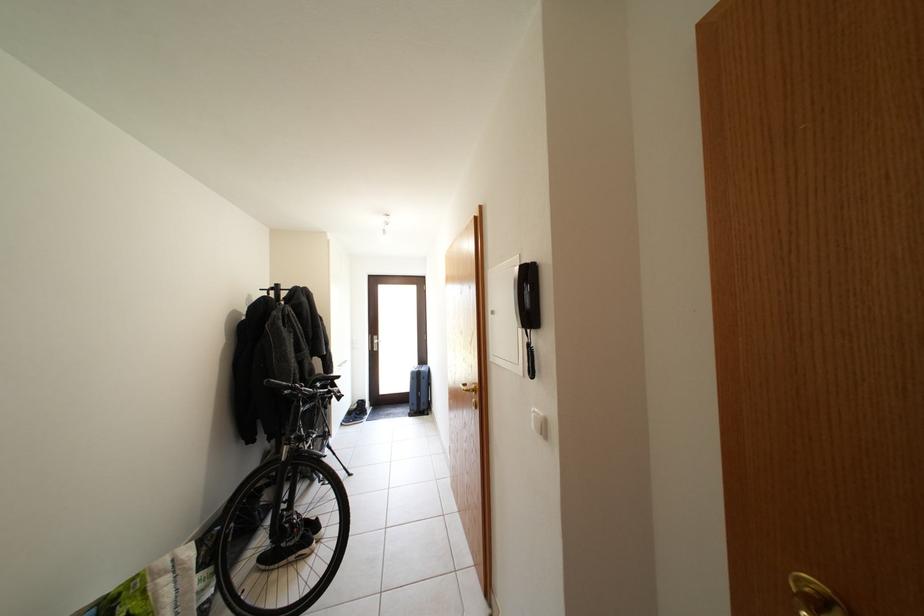
Where is `gold door knob`? Image resolution: width=924 pixels, height=616 pixels. gold door knob is located at coordinates (813, 596).